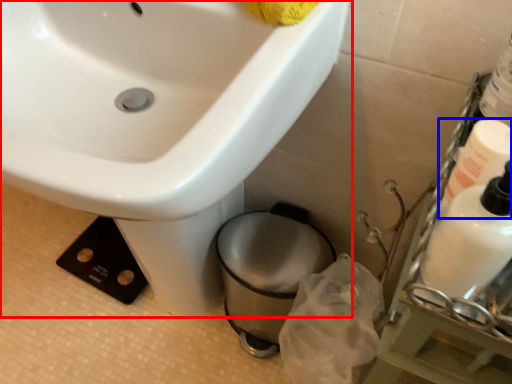
Question: Among these objects, which one is farthest to the camera, sink (highlighted by a red box) or cleaning product (highlighted by a blue box)?

Choices:
 (A) sink
 (B) cleaning product

Answer: (B)